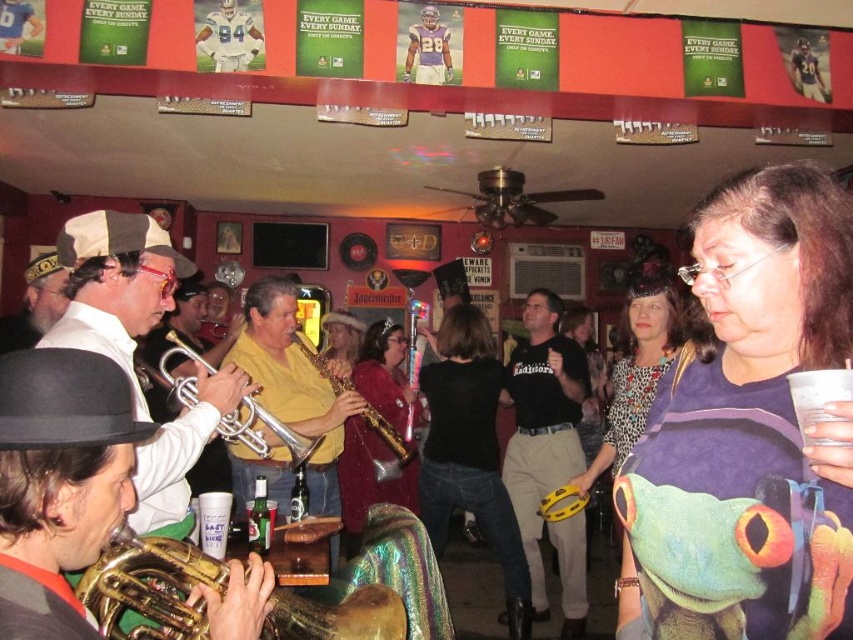
Question: Which of the following is the farthest from the observer?

Choices:
 (A) (119, 515)
 (B) (195, 400)

Answer: (B)

Question: Which is nearer to the purple printed shirt at center?

Choices:
 (A) matte gold trumpet at left
 (B) black matte shirt at center
 (C) silver metallic trumpet at center

Answer: (A)

Question: Does black matte t-shirt at center have a larger size compared to silver metallic trumpet at center?

Choices:
 (A) yes
 (B) no

Answer: (A)

Question: Is black matte shirt at center closer to the viewer compared to gold shiny trumpet at center?

Choices:
 (A) yes
 (B) no

Answer: (B)

Question: Based on their relative distances, which object is farther from the matte yellow shirt at center?

Choices:
 (A) silver metallic trumpet at center
 (B) purple fabric dress at center
 (C) gold shiny saxophone at center
 (D) black matte t-shirt at center

Answer: (B)

Question: Does gold shiny saxophone at center lie behind shiny gold saxophone at center?

Choices:
 (A) no
 (B) yes

Answer: (A)